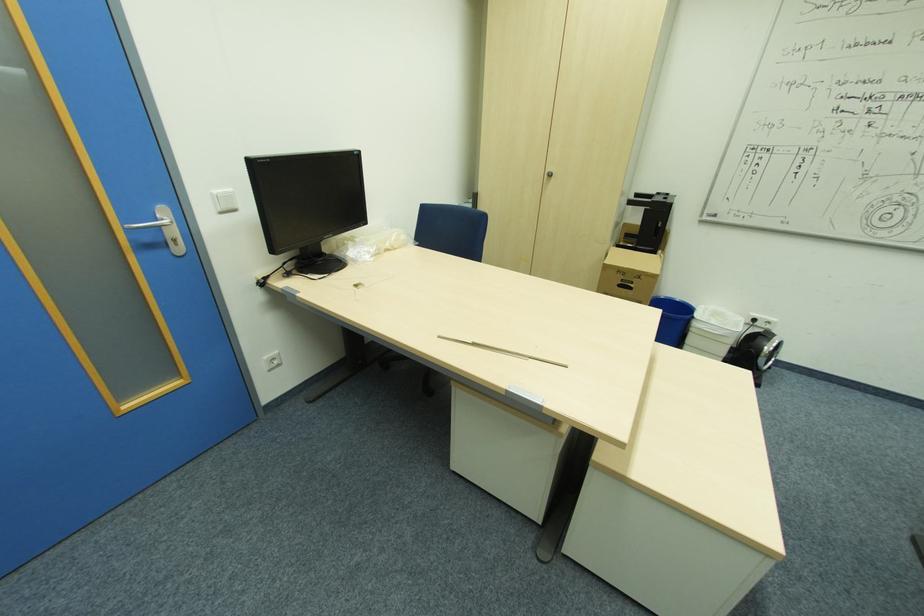
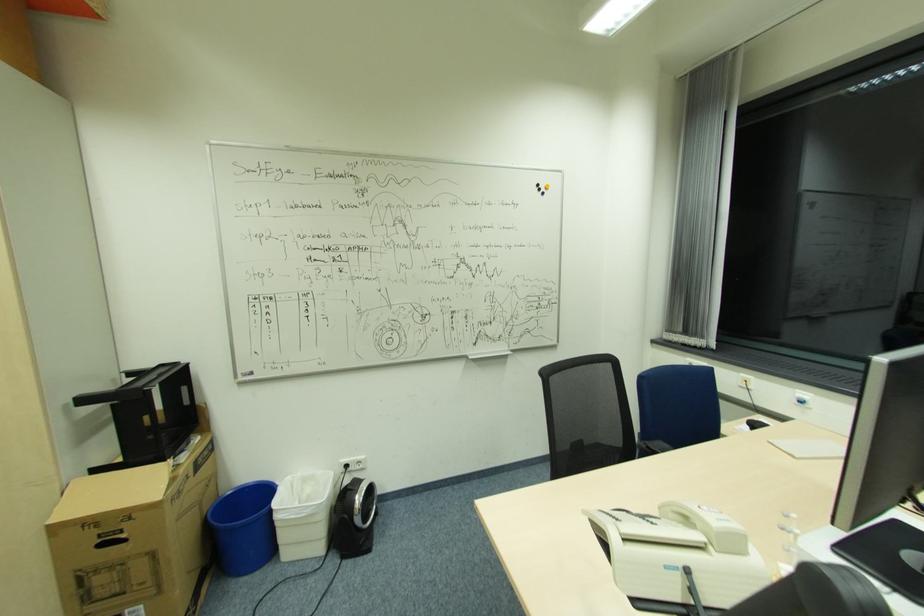
In the second image, find the point that corresponds to pixel 704 306 in the first image.

(290, 477)